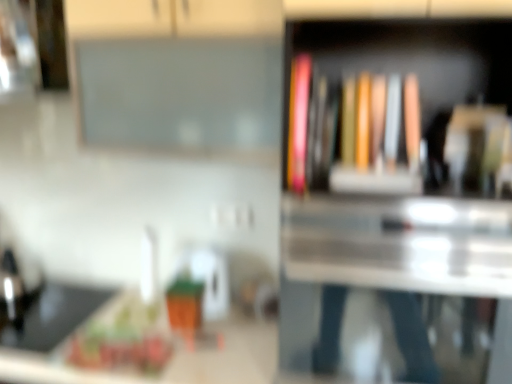
Question: From the image's perspective, is matte pink book at upper right, the first book from the left, positioned above or below white glossy kettle at center?

Choices:
 (A) above
 (B) below

Answer: (A)

Question: Is matte pink book at upper right, the first book from the left, bigger or smaller than white glossy kettle at center?

Choices:
 (A) big
 (B) small

Answer: (B)

Question: Estimate the real-world distances between objects in this image. Which object is closer to the black matte sink at lower left?

Choices:
 (A) white glossy counter top at lower left
 (B) matte pink book at upper right, the first book from the left
 (C) wooden bookshelf at center
 (D) matte hardcover book at center, the second book from the left
 (E) white glossy kettle at center

Answer: (A)

Question: Estimate the real-world distances between objects in this image. Which object is farther from the white glossy counter top at lower left?

Choices:
 (A) matte pink book at upper right, the second book viewed from the right
 (B) black matte sink at lower left
 (C) matte hardcover book at center, positioned as the first book in right-to-left order
 (D) wooden bookshelf at center
 (E) white glossy kettle at center

Answer: (A)